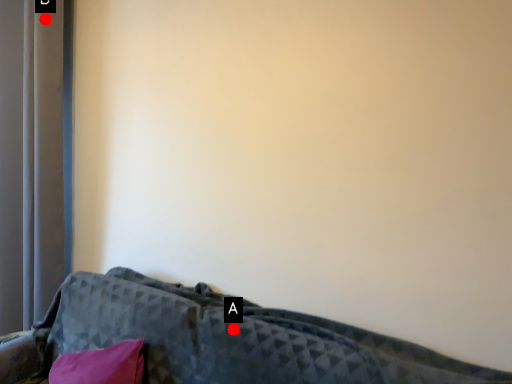
Question: Two points are circled on the image, labeled by A and B beside each circle. Which of the following is the farthest from the observer?

Choices:
 (A) A is further
 (B) B is further

Answer: (B)